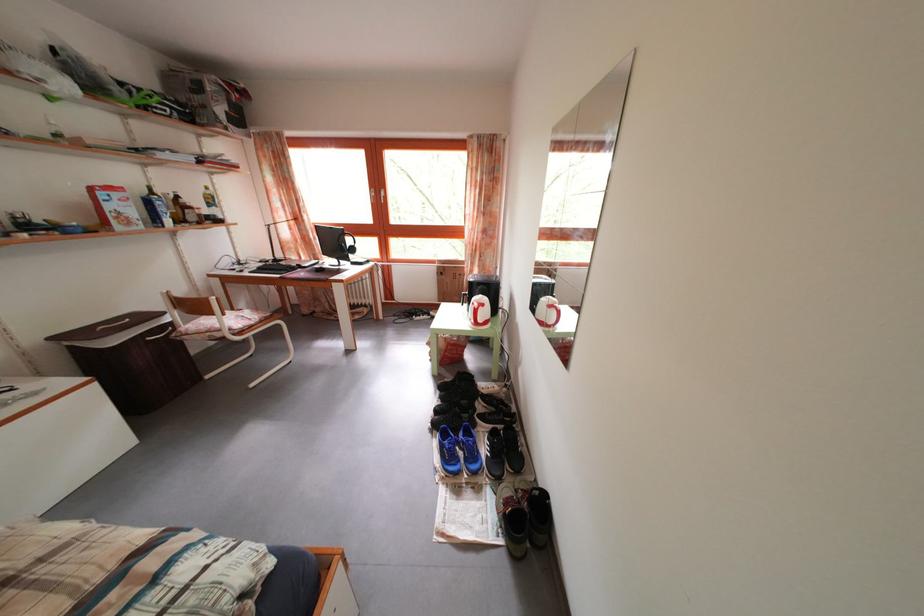
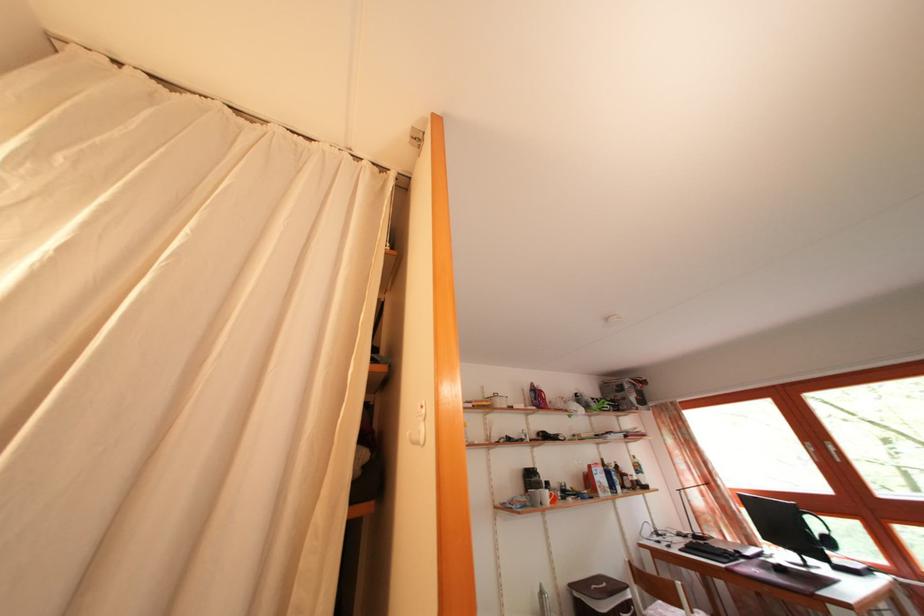
First-person continuous shooting, in which direction is the camera rotating?

The camera rotated toward left-up.